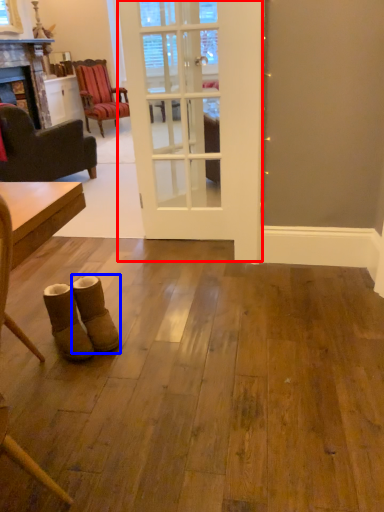
Question: Which object is closer to the camera taking this photo, door (highlighted by a red box) or footwear (highlighted by a blue box)?

Choices:
 (A) door
 (B) footwear

Answer: (B)